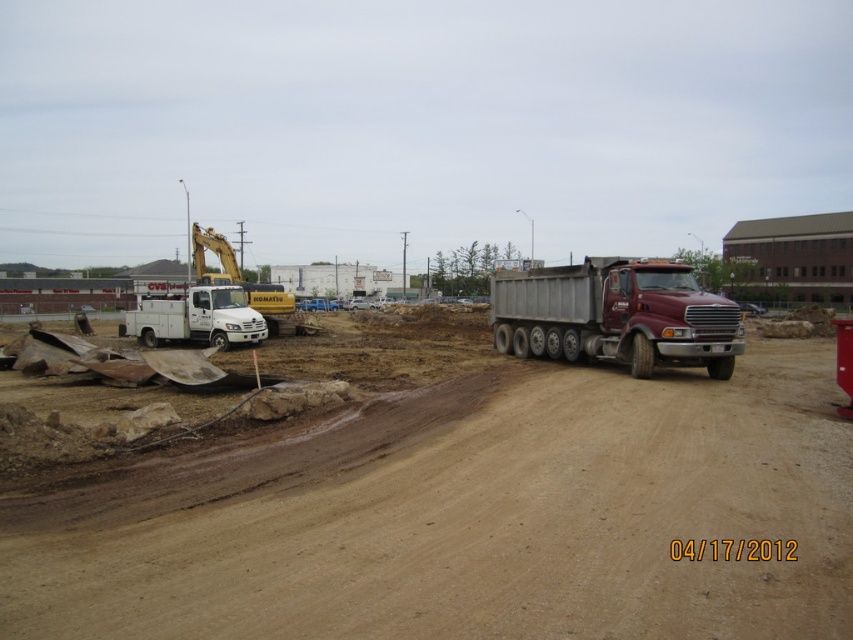
Question: Does maroon metallic dump truck at right come in front of white matte utility truck at left?

Choices:
 (A) yes
 (B) no

Answer: (A)

Question: Among these points, which one is nearest to the camera?

Choices:
 (A) (x=714, y=371)
 (B) (x=165, y=298)

Answer: (A)

Question: Does maroon metallic dump truck at right appear over white matte utility truck at left?

Choices:
 (A) yes
 (B) no

Answer: (B)

Question: Is maroon metallic dump truck at right below white matte utility truck at left?

Choices:
 (A) no
 (B) yes

Answer: (B)

Question: Among these points, which one is farthest from the camera?

Choices:
 (A) (178, 340)
 (B) (698, 292)

Answer: (A)

Question: Among these objects, which one is farthest from the camera?

Choices:
 (A) maroon metallic dump truck at right
 (B) white matte utility truck at left

Answer: (B)